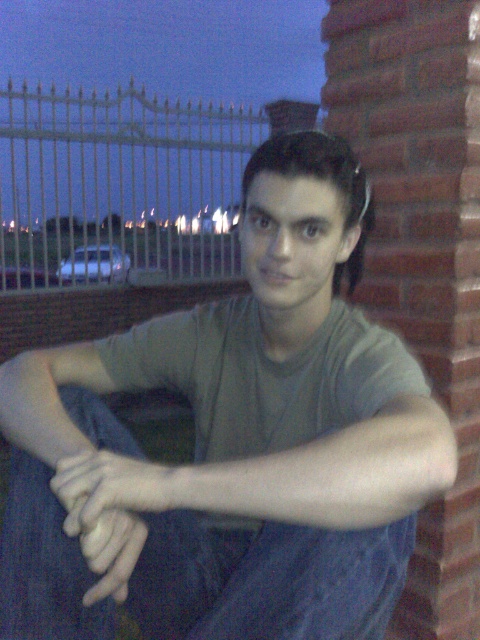
Does white metal fence at upper left have a greater width compared to gray matte arm at center?

Yes.

Locate an element on the screen. Image resolution: width=480 pixels, height=640 pixels. white metal fence at upper left is located at coordinates (120, 188).

Does point (47, 509) come behind point (100, 454)?

Yes, it is.

Does denim at left appear over smooth skin hand at center?

No.

This screenshot has width=480, height=640. Find the location of `denim at left`. denim at left is located at coordinates (44, 564).

Where is `denim at left`? denim at left is located at coordinates (44, 564).

Who is higher up, matte gray t-shirt at center or smooth skin hand at center?

Positioned higher is matte gray t-shirt at center.

Looking at this image, is matte gray t-shirt at center smaller than smooth skin hand at center?

No.

Does point (327, 486) come behind point (74, 529)?

No, (327, 486) is closer to viewer.

Identify the location of matte gray t-shirt at center. The height and width of the screenshot is (640, 480). [x=239, y=440].